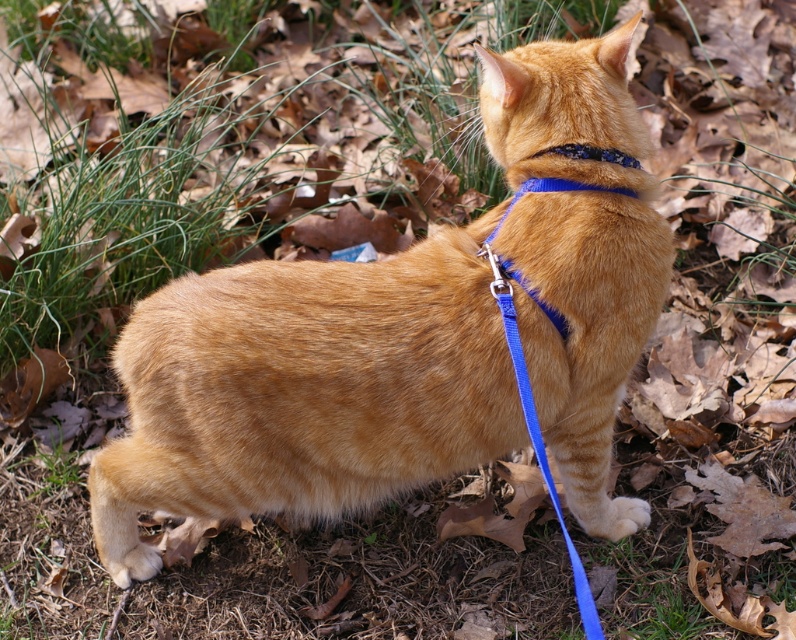
Question: Which object is closer to the camera taking this photo?

Choices:
 (A) shiny blue collar at upper center
 (B) orange fur cat at center

Answer: (B)

Question: Is orange fur cat at center below shiny blue collar at upper center?

Choices:
 (A) no
 (B) yes

Answer: (B)

Question: Is orange fur cat at center positioned in front of shiny blue collar at upper center?

Choices:
 (A) no
 (B) yes

Answer: (B)

Question: From the image, what is the correct spatial relationship of orange fur cat at center in relation to shiny blue collar at upper center?

Choices:
 (A) right
 (B) left

Answer: (B)

Question: Which point is farther to the camera?

Choices:
 (A) (506, 323)
 (B) (603, 150)
 (C) (369, 481)

Answer: (C)

Question: Which point is farther to the camera?

Choices:
 (A) shiny blue collar at upper center
 (B) orange fur cat at center

Answer: (A)